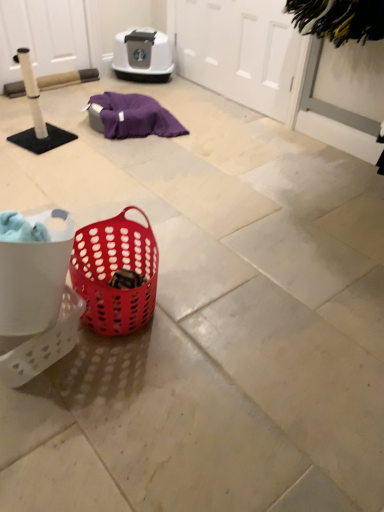
Question: Is white perforated basket at lower left shorter than white matte screen door at upper center, placed as the 2th screen door when sorted from left to right?

Choices:
 (A) no
 (B) yes

Answer: (B)

Question: Does white perforated basket at lower left appear on the left side of white matte screen door at upper center, arranged as the 1th screen door when viewed from the right?

Choices:
 (A) yes
 (B) no

Answer: (A)

Question: Are white perforated basket at lower left and white matte screen door at upper center, placed as the 2th screen door when sorted from left to right, located far from each other?

Choices:
 (A) yes
 (B) no

Answer: (A)

Question: From a real-world perspective, is white perforated basket at lower left physically above white matte screen door at upper center, placed as the 2th screen door when sorted from left to right?

Choices:
 (A) yes
 (B) no

Answer: (B)

Question: Does white perforated basket at lower left have a lesser width compared to white matte screen door at upper center, placed as the 2th screen door when sorted from left to right?

Choices:
 (A) no
 (B) yes

Answer: (A)

Question: In terms of width, does matte plastic basket at center look wider or thinner when compared to black fuzzy brush at upper right?

Choices:
 (A) thin
 (B) wide

Answer: (A)

Question: Relative to black fuzzy brush at upper right, is matte plastic basket at center in front or behind?

Choices:
 (A) behind
 (B) front

Answer: (B)

Question: From the image's perspective, relative to black fuzzy brush at upper right, is matte plastic basket at center above or below?

Choices:
 (A) above
 (B) below

Answer: (B)

Question: Is matte plastic basket at center situated inside black fuzzy brush at upper right or outside?

Choices:
 (A) outside
 (B) inside

Answer: (A)

Question: Based on their sizes in the image, would you say white matte screen door at upper left, the second screen door viewed from the right, is bigger or smaller than white matte screen door at upper center, placed as the 2th screen door when sorted from left to right?

Choices:
 (A) big
 (B) small

Answer: (B)

Question: From a real-world perspective, is white matte screen door at upper left, the 1th screen door in the left-to-right sequence, physically located above or below white matte screen door at upper center, arranged as the 1th screen door when viewed from the right?

Choices:
 (A) above
 (B) below

Answer: (B)

Question: Based on their positions, is white matte screen door at upper left, the 1th screen door in the left-to-right sequence, located to the left or right of white matte screen door at upper center, placed as the 2th screen door when sorted from left to right?

Choices:
 (A) right
 (B) left

Answer: (B)

Question: Is point (1, 47) closer or farther from the camera than point (228, 15)?

Choices:
 (A) closer
 (B) farther

Answer: (B)

Question: Looking at the image, does white perforated basket at lower left seem bigger or smaller compared to white matte screen door at upper center, placed as the 2th screen door when sorted from left to right?

Choices:
 (A) big
 (B) small

Answer: (B)

Question: Considering the positions of white perforated basket at lower left and white matte screen door at upper center, arranged as the 1th screen door when viewed from the right, in the image, is white perforated basket at lower left wider or thinner than white matte screen door at upper center, arranged as the 1th screen door when viewed from the right,?

Choices:
 (A) wide
 (B) thin

Answer: (A)